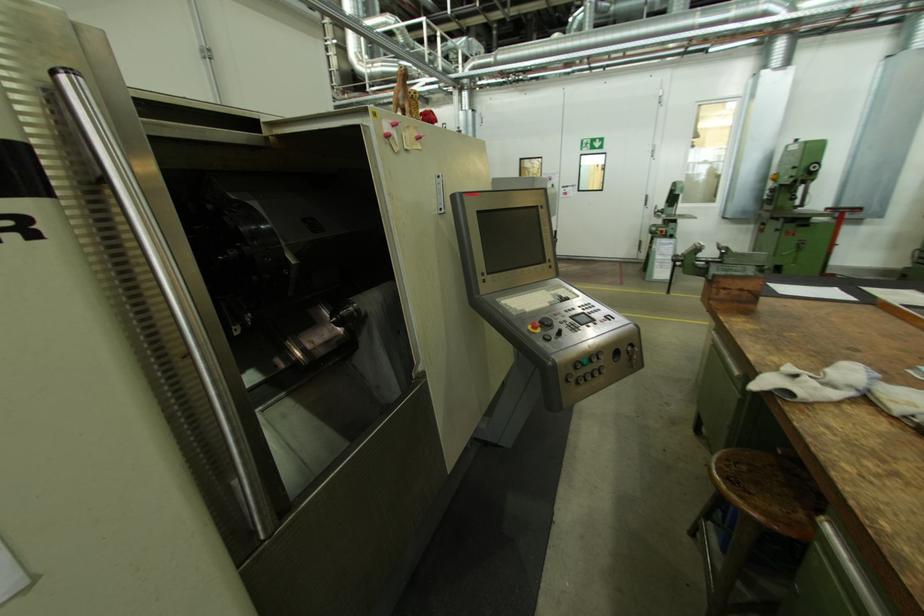
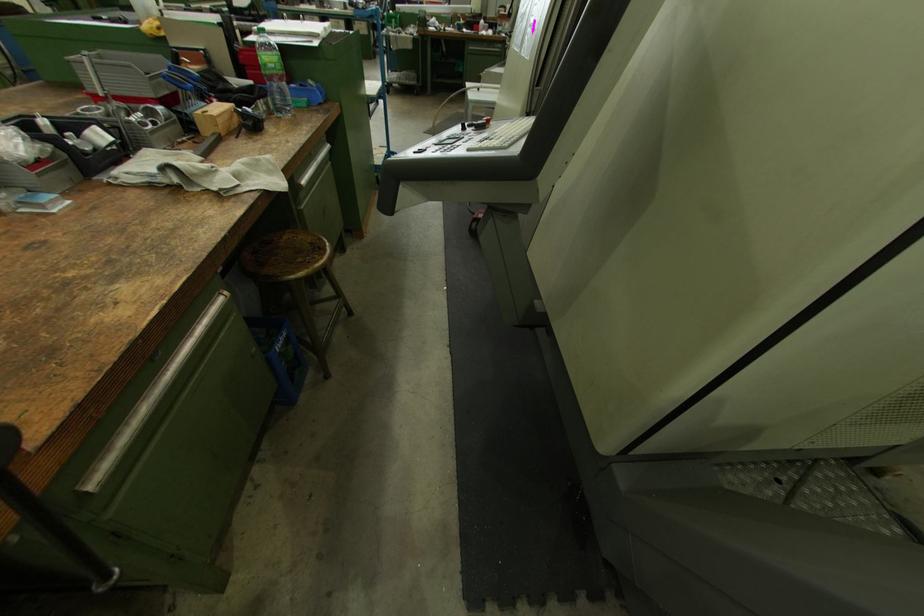
Question: I am providing you with two images of the same scene from different viewpoints. Please identify which objects are invisible in image2.

Choices:
 (A) white control dial
 (B) small wooden block
 (C) black control dial
 (D) paper output tray

Answer: (C)